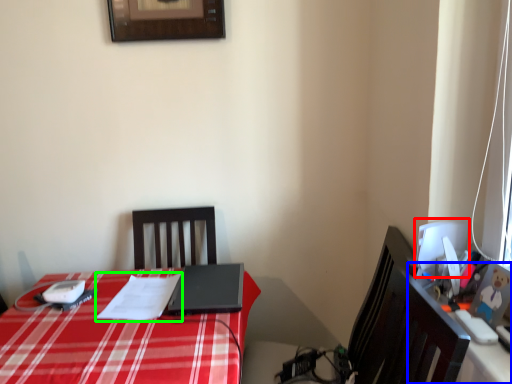
Question: Which object is positioned farthest from computer monitor (highlighted by a red box)? Select from computer desk (highlighted by a blue box) and notepad (highlighted by a green box).

Choices:
 (A) computer desk
 (B) notepad

Answer: (B)